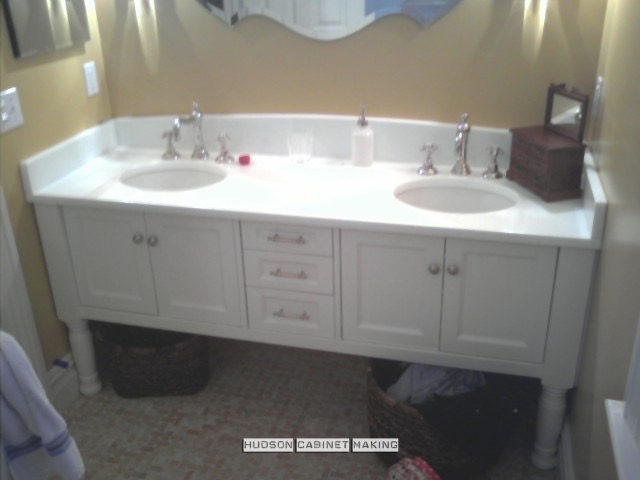
The width and height of the screenshot is (640, 480). What are the coordinates of `cup` in the screenshot? It's located at (300, 145).